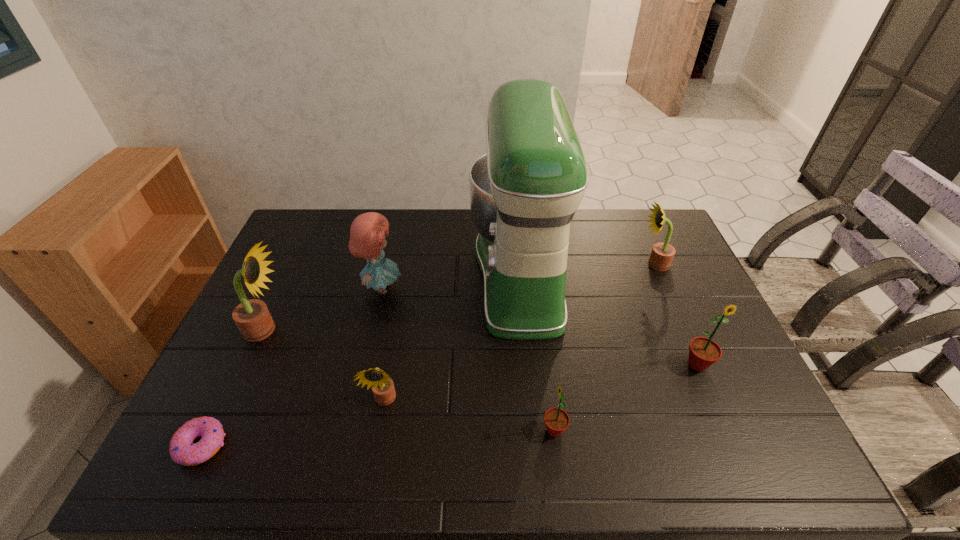
Find the location of `vacant area situated 0.090m on the face of the rightmost yellow sunflower`. vacant area situated 0.090m on the face of the rightmost yellow sunflower is located at coordinates (612, 264).

Find the location of a particular element. The width and height of the screenshot is (960, 540). vacant space situated 0.150m on the face of the rightmost yellow sunflower is located at coordinates 594,264.

The height and width of the screenshot is (540, 960). In order to click on free space located on the face of the rightmost yellow sunflower in this screenshot , I will do `click(573, 264)`.

The width and height of the screenshot is (960, 540). I want to click on vacant point located 0.200m on the face of the right green sunflower, so click(x=734, y=451).

I want to click on vacant point located on the face of the left green sunflower, so click(x=453, y=430).

The width and height of the screenshot is (960, 540). What are the coordinates of `vacant position located 0.280m on the face of the left green sunflower` in the screenshot? It's located at pos(423,430).

I want to click on free space located 0.300m on the face of the left green sunflower, so click(x=415, y=430).

Where is `vacant region located 0.110m on the face of the smallest yellow sunflower`? This screenshot has height=540, width=960. vacant region located 0.110m on the face of the smallest yellow sunflower is located at coordinates (374, 459).

Find the location of a particular element. The width and height of the screenshot is (960, 540). free location located on the right of the pink doughnut is located at coordinates (291, 446).

I want to click on object situated at the far edge, so click(524, 192).